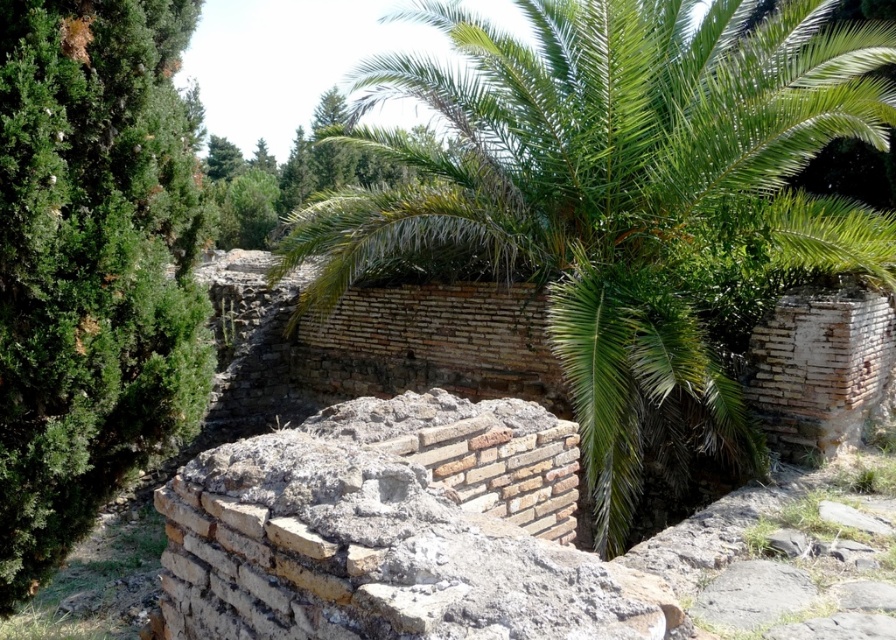
Question: Is green leafy palm at center thinner than green textured tree at left?

Choices:
 (A) yes
 (B) no

Answer: (A)

Question: Which object appears farthest from the camera in this image?

Choices:
 (A) green textured tree at left
 (B) green leafy palm at center

Answer: (B)

Question: Can you confirm if green leafy palm at center is wider than green textured tree at left?

Choices:
 (A) no
 (B) yes

Answer: (A)

Question: Which object appears closest to the camera in this image?

Choices:
 (A) green leafy palm at center
 (B) green textured tree at left

Answer: (B)

Question: Which point is closer to the camera taking this photo?

Choices:
 (A) (9, 209)
 (B) (554, 164)

Answer: (A)

Question: Is the position of green leafy palm at center less distant than that of green textured tree at left?

Choices:
 (A) no
 (B) yes

Answer: (A)